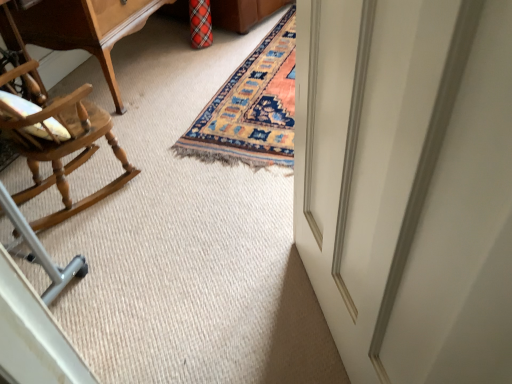
Describe the element at coordinates (408, 184) in the screenshot. I see `white glossy door at right` at that location.

The image size is (512, 384). What are the coordinates of `white glossy door at right` in the screenshot? It's located at (408, 184).

Which of these two, light brown wood rocking chair at left or white glossy door at right, stands shorter?

light brown wood rocking chair at left.

Is light brown wood rocking chair at left inside or outside of white glossy door at right?

light brown wood rocking chair at left is not enclosed by white glossy door at right.

Based on the photo, which object is positioned more to the right, light brown wood rocking chair at left or white glossy door at right?

white glossy door at right is more to the right.

At what (x,y) coordinates should I click in order to perform the action: click on door that appears above the light brown wood rocking chair at left (from a real-world perspective). Please return your answer as a coordinate pair (x, y). Image resolution: width=512 pixels, height=384 pixels. Looking at the image, I should click on (408, 184).

Does wooden table at upper left have a lesser height compared to white glossy door at right?

Indeed, wooden table at upper left has a lesser height compared to white glossy door at right.

From the image's perspective, which one is positioned lower, wooden table at upper left or white glossy door at right?

white glossy door at right is shown below in the image.

Considering the relative positions of wooden table at upper left and white glossy door at right in the image provided, is wooden table at upper left to the right of white glossy door at right from the viewer's perspective?

In fact, wooden table at upper left is to the left of white glossy door at right.

I want to click on table above the white glossy door at right (from the image's perspective), so [x=86, y=28].

From the image's perspective, is white glossy door at right located above or below wooden table at upper left?

white glossy door at right is situated lower than wooden table at upper left in the image.

Is white glossy door at right turned away from wooden table at upper left?

white glossy door at right does not have its back to wooden table at upper left.

Considering the relative sizes of white glossy door at right and wooden table at upper left in the image provided, is white glossy door at right taller than wooden table at upper left?

Yes, white glossy door at right is taller than wooden table at upper left.

Does white glossy door at right lie in front of wooden table at upper left?

Yes, white glossy door at right is closer to the camera.

In the scene shown: In terms of size, does white glossy door at right appear bigger or smaller than light brown wood rocking chair at left?

In the image, white glossy door at right appears to be smaller than light brown wood rocking chair at left.

Are white glossy door at right and light brown wood rocking chair at left far apart?

Indeed, white glossy door at right is not near light brown wood rocking chair at left.

Is white glossy door at right wider than light brown wood rocking chair at left?

No, white glossy door at right is not wider than light brown wood rocking chair at left.

Can you tell me how much white glossy door at right and light brown wood rocking chair at left differ in facing direction?

The angular difference between white glossy door at right and light brown wood rocking chair at left is 140 degrees.

From the image's perspective, between light brown wood rocking chair at left and wooden table at upper left, which one is located above?

From the image's view, wooden table at upper left is above.

Is light brown wood rocking chair at left facing away from wooden table at upper left?

No.

Which of these two, wooden table at upper left or light brown wood rocking chair at left, is wider?

wooden table at upper left.

Considering their positions, is wooden table at upper left located in front of or behind light brown wood rocking chair at left?

→ wooden table at upper left is positioned farther from the viewer than light brown wood rocking chair at left.

Based on the photo, is there a large distance between wooden table at upper left and light brown wood rocking chair at left?

wooden table at upper left is near light brown wood rocking chair at left, not far away.

Is wooden table at upper left oriented away from light brown wood rocking chair at left?

No, wooden table at upper left's orientation is not away from light brown wood rocking chair at left.

The height and width of the screenshot is (384, 512). Identify the location of chair behind the white glossy door at right. (65, 151).

Identify the location of table on the left of white glossy door at right. (86, 28).

Estimate the real-world distances between objects in this image. Which object is closer to light brown wood rocking chair at left, white glossy door at right or wooden table at upper left?

Based on the image, wooden table at upper left appears to be nearer to light brown wood rocking chair at left.

Based on their spatial positions, is light brown wood rocking chair at left or wooden table at upper left closer to white glossy door at right?

Among the two, light brown wood rocking chair at left is located nearer to white glossy door at right.

Based on their spatial positions, is wooden table at upper left or white glossy door at right further from light brown wood rocking chair at left?

white glossy door at right.

Looking at the image, which one is located further to wooden table at upper left, white glossy door at right or light brown wood rocking chair at left?

The object further to wooden table at upper left is white glossy door at right.

Considering their positions, is wooden table at upper left positioned further to white glossy door at right than light brown wood rocking chair at left?

Based on the image, wooden table at upper left appears to be further to white glossy door at right.

Based on their spatial positions, is light brown wood rocking chair at left or white glossy door at right closer to wooden table at upper left?

Among the two, light brown wood rocking chair at left is located nearer to wooden table at upper left.

Find the location of a particular element. This screenshot has height=384, width=512. chair positioned between white glossy door at right and wooden table at upper left from near to far is located at coordinates (65, 151).